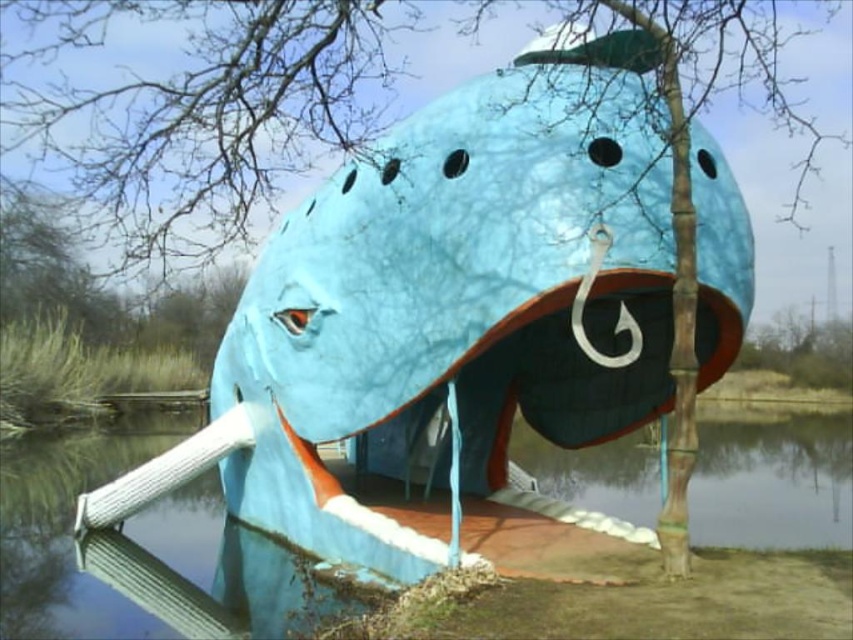
You are standing in front of the fish sculpture and want to place a small statue on the green bamboo tree at upper center so it can be seen from the blue plastic water at lower center. Is this possible?

The green bamboo tree at upper center is above the blue plastic water at lower center, so placing the statue on the tree would make it visible from the water.

You are standing at the base of the fish sculpture and want to locate the green bamboo tree at upper center. According to the coordinates provided, in which direction should you look to see it?

The green bamboo tree at upper center is located at coordinates point (223, 100), which is in the upper part of the image. You should look upwards to see it.